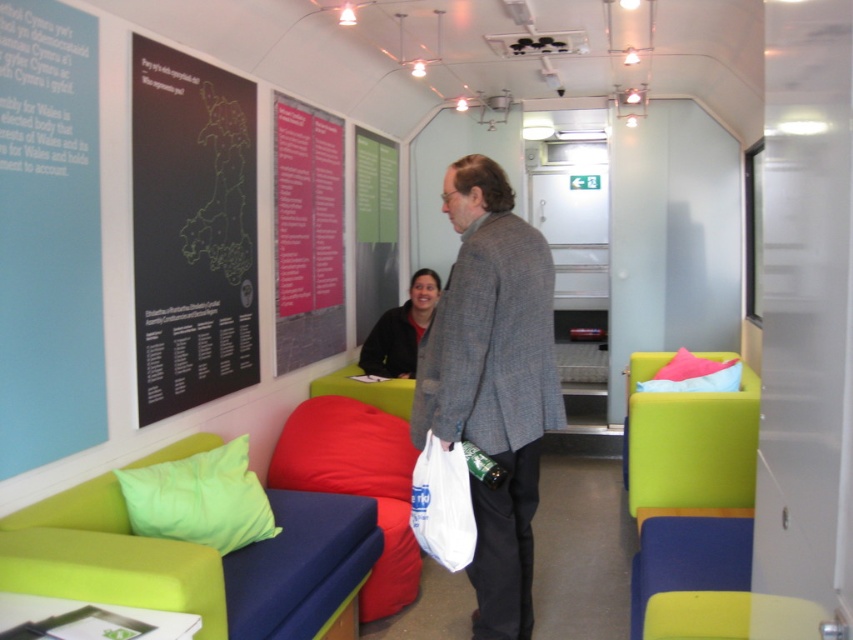
You are attending a political event and see two jackets hanging on a rack in the middle of the room. The jackets are the gray woolen blazer at center and the matte black jacket at center. Which jacket is on the right side when viewed from the front?

The gray woolen blazer at center is positioned on the right side of the matte black jacket at center, so when viewed from the front, the gray woolen blazer at center is on the right.

In the scene shown: You are organizing a clothing donation drive and need to determine if the gray woolen blazer at center and the matte black jacket at center can fit into a standard donation box that measures 30x30x30 cm. Based on their sizes, which one is more likely to fit?

The matte black jacket at center is smaller than the gray woolen blazer at center, so the matte black jacket at center is more likely to fit into the standard donation box.